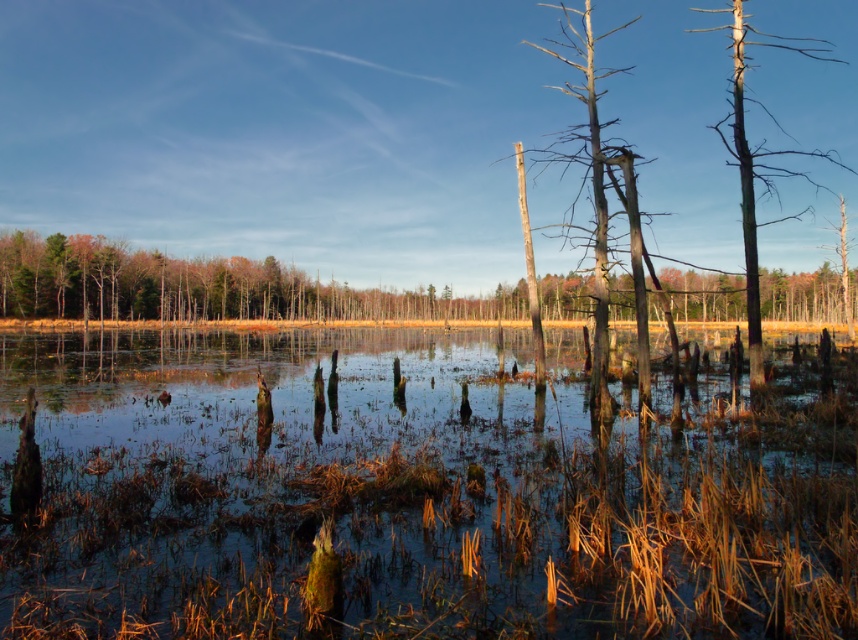
You are standing at the edge of the wetland and want to walk to the clear water at center. Which direction should you move to reach it?

The clear water at center is located at point coordinates of (414, 492), so you should move towards the center of the wetland to reach it.

You are standing at the edge of the wetland and want to cross to the other side. You see the clear water at center and the dark brown wood tree at upper right. Which one has a wider area? Please choose between them.

The dark brown wood tree at upper right has a wider area than the clear water at center.